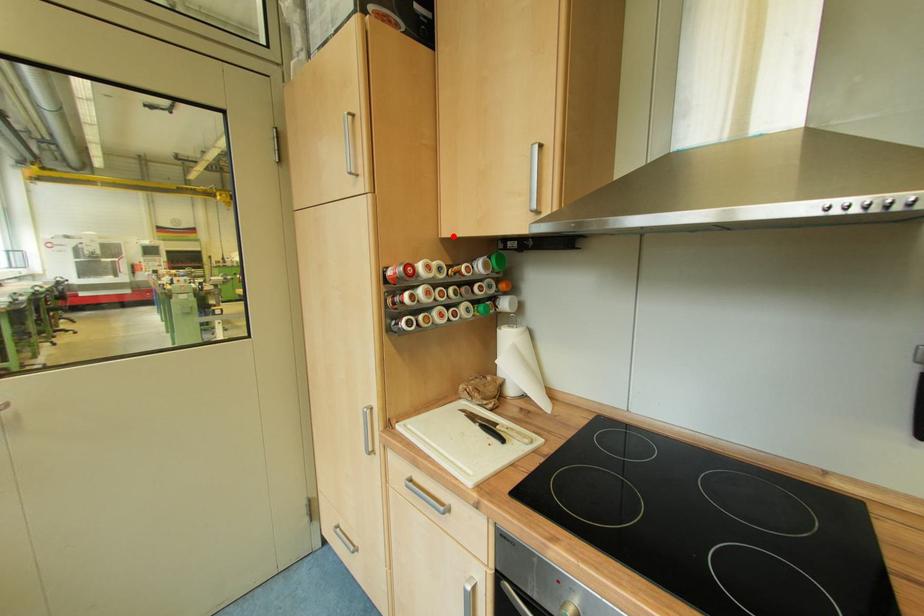
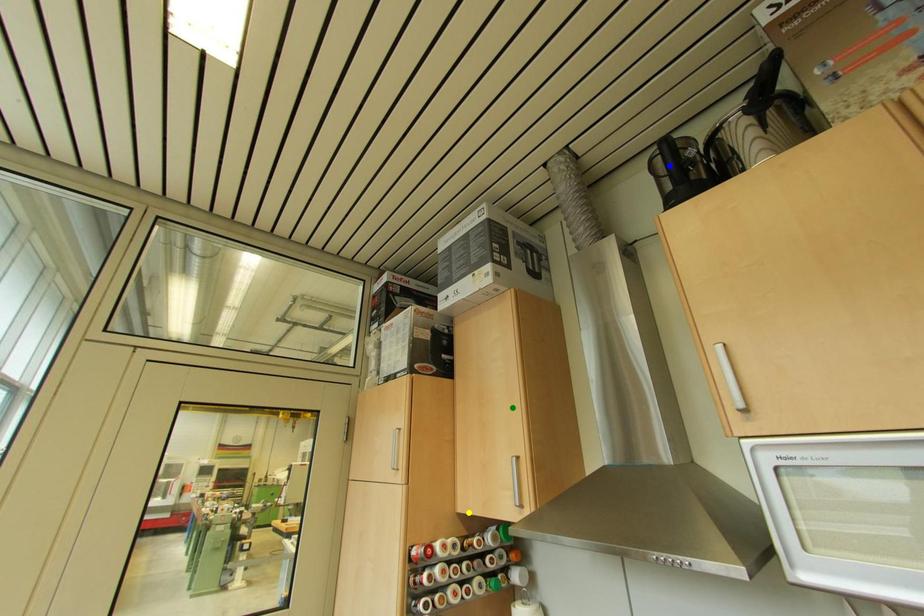
Question: I am providing you with two images of the same scene from different viewpoints. A red point is marked on the first image. You are given multiple points on the second image. Which mark in image 2 goes with the point in image 1?

Choices:
 (A) green point
 (B) yellow point
 (C) blue point

Answer: (B)